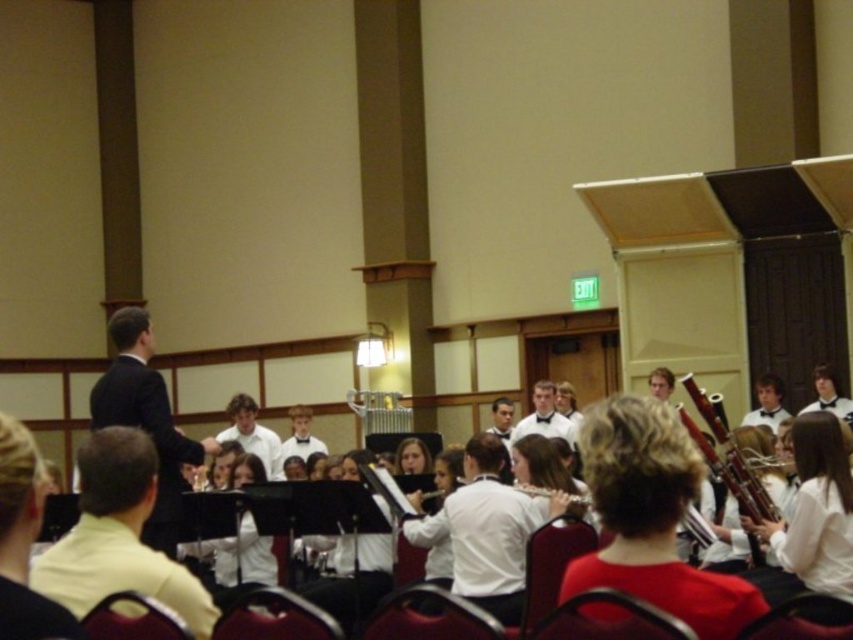
Is black suit at left taller than white bow tie at center?

Yes.

Is black suit at left thinner than white bow tie at center?

No.

Where is `black suit at left`? black suit at left is located at coordinates (146, 419).

Which is more to the right, wooden bassoon at right or white wood flute at center?

wooden bassoon at right is more to the right.

Is point (692, 380) closer to camera compared to point (531, 490)?

No, it is behind (531, 490).

At what (x,y) coordinates should I click in order to perform the action: click on wooden bassoon at right. Please return your answer as a coordinate pair (x, y). This screenshot has width=853, height=640. Looking at the image, I should click on (727, 458).

Does white bow tie at center appear on the right side of white wood flute at center?

Yes, white bow tie at center is to the right of white wood flute at center.

Who is shorter, white bow tie at center or white wood flute at center?

Standing shorter between the two is white wood flute at center.

The height and width of the screenshot is (640, 853). Find the location of `white bow tie at center`. white bow tie at center is located at coordinates (x=544, y=417).